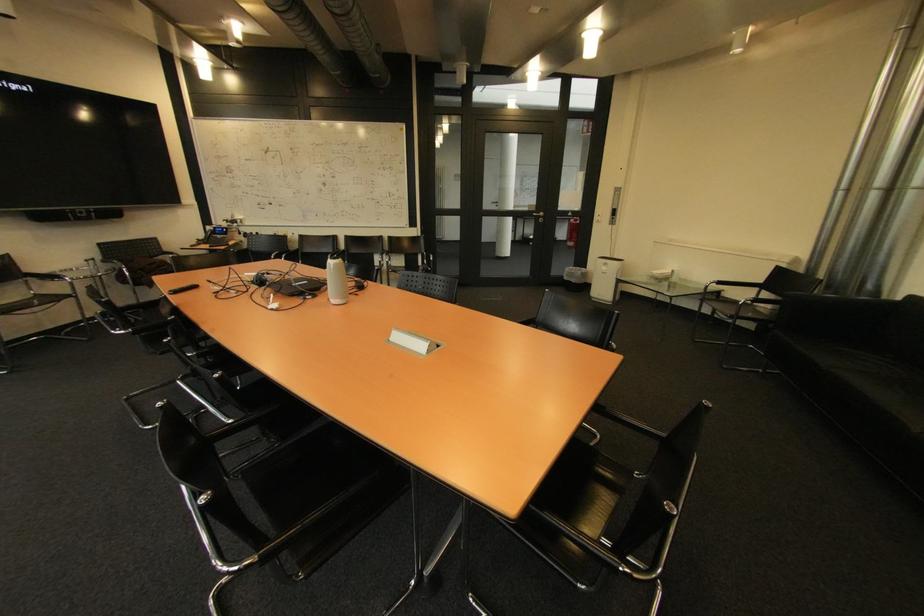
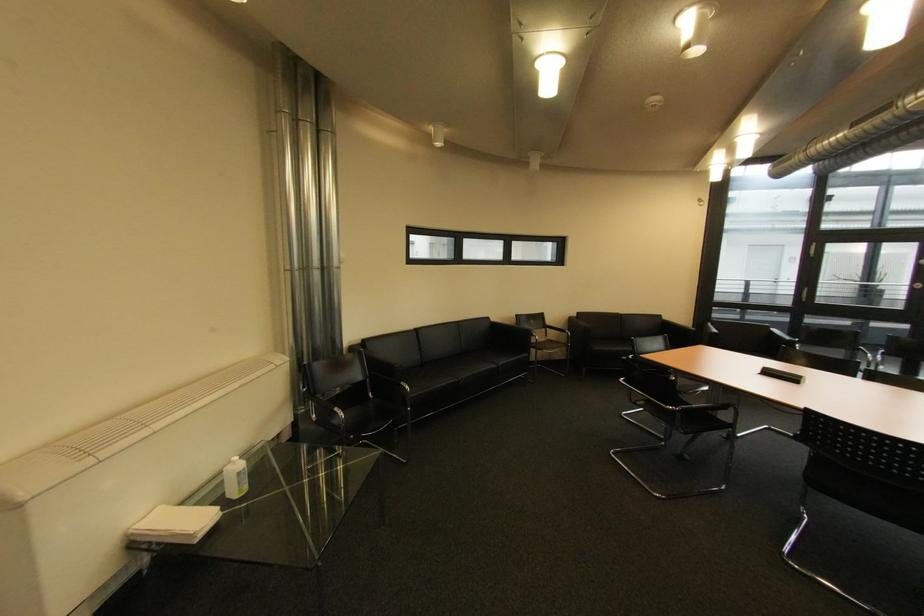
Question: I am providing you with two images of the same scene from different viewpoints. Which of the following objects are not visible in image2?

Choices:
 (A) black chair sitting surface
 (B) sofa armrest
 (C) small white stool
 (D) chair armrest

Answer: (A)